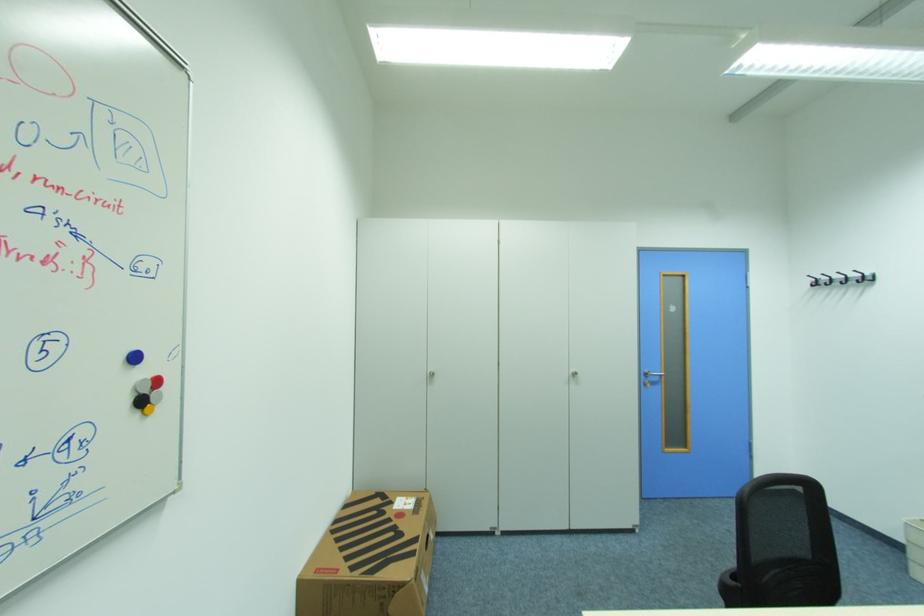
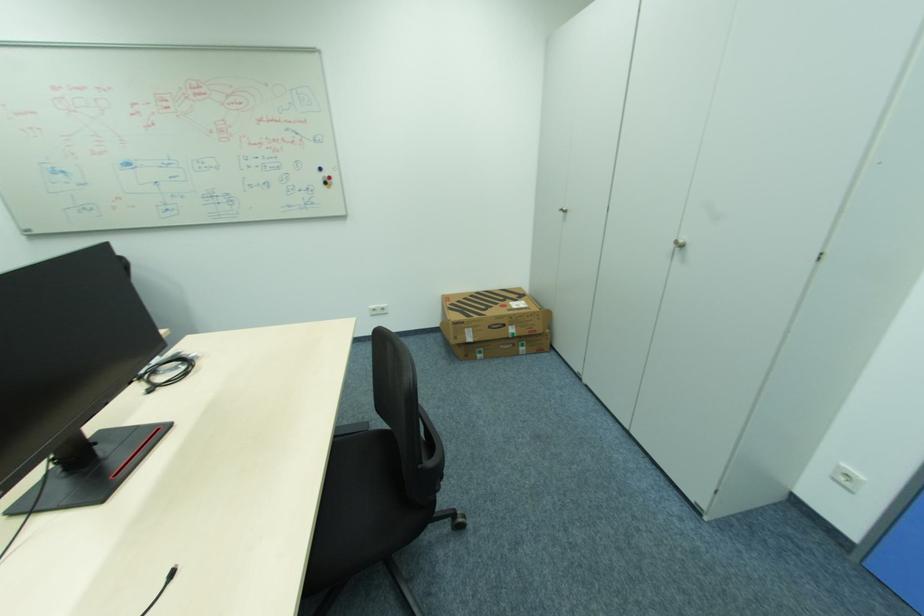
The point at (146, 403) is marked in the first image. Where is the corresponding point in the second image?

(331, 184)